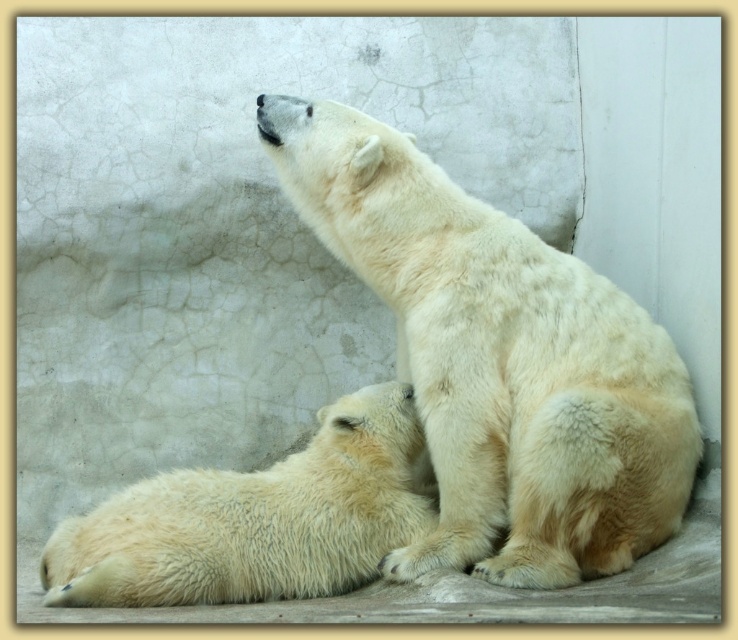
Question: Does white fluffy polar bear at center appear under white fluffy polar bear at lower left?

Choices:
 (A) no
 (B) yes

Answer: (A)

Question: Is white fluffy polar bear at center to the left of white fluffy polar bear at lower left from the viewer's perspective?

Choices:
 (A) yes
 (B) no

Answer: (B)

Question: Is white fluffy polar bear at center to the left of white fluffy polar bear at lower left from the viewer's perspective?

Choices:
 (A) no
 (B) yes

Answer: (A)

Question: Among these objects, which one is nearest to the camera?

Choices:
 (A) white fluffy polar bear at center
 (B) white fluffy polar bear at lower left

Answer: (A)

Question: Which object appears farthest from the camera in this image?

Choices:
 (A) white fluffy polar bear at center
 (B) white fluffy polar bear at lower left

Answer: (B)